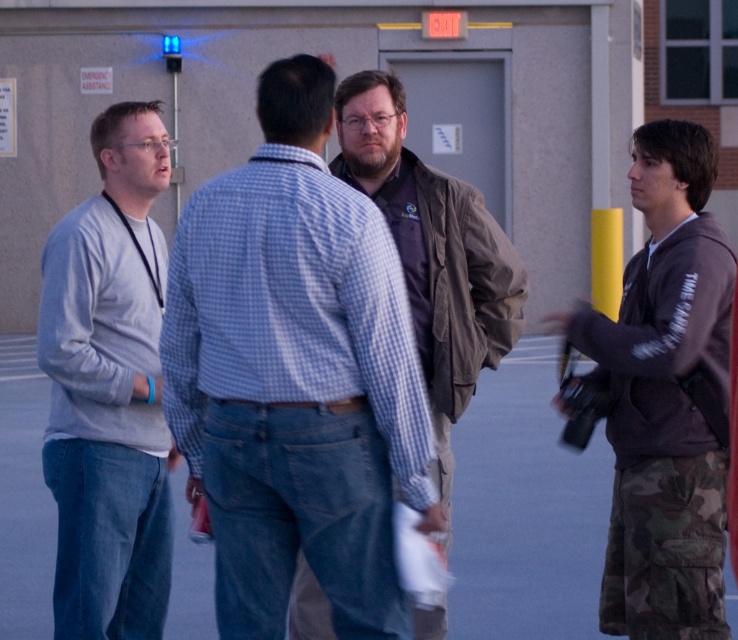
Based on the photo, you are a photographer standing behind the group of men. You want to take a photo of the brown fabric jacket at center without the blue checkered shirt at center blocking it. What should you do?

Move to the side so that the brown fabric jacket at center is no longer behind the blue checkered shirt at center.